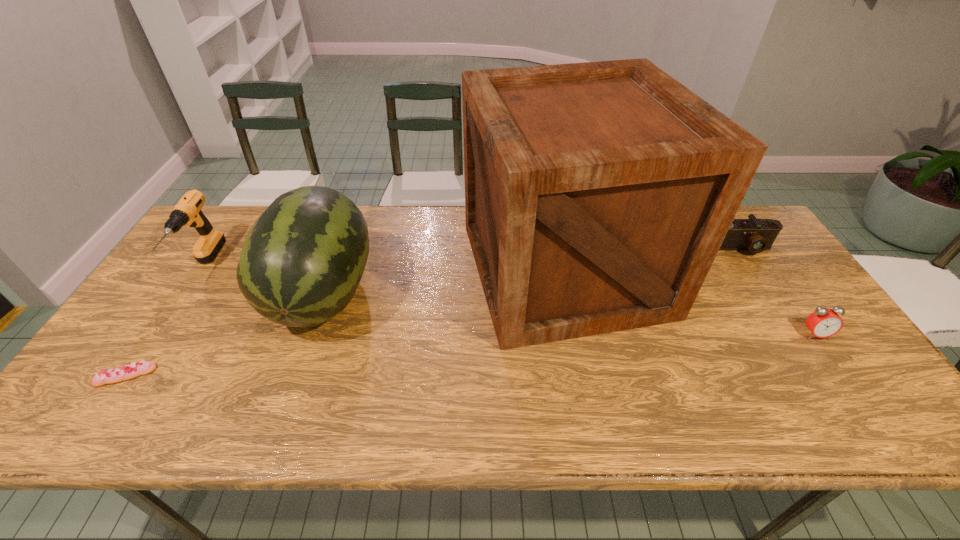
Locate an element on the screen. free space between the nearest object and the drill is located at coordinates (165, 321).

Locate an element on the screen. This screenshot has width=960, height=540. free space between the eclair and the alarm clock is located at coordinates (470, 355).

You are a GUI agent. You are given a task and a screenshot of the screen. Output one action in this format:
    pyautogui.click(x=<x>, y=<y>)
    Task: Click on the blank region between the camera and the eclair
    
    Given the screenshot: What is the action you would take?
    pyautogui.click(x=433, y=312)

The width and height of the screenshot is (960, 540). What are the coordinates of `free space that is in between the eclair and the fourth object from left to right` in the screenshot? It's located at (345, 322).

Identify the location of object that is the third closest one to the tallest object. (823, 322).

Locate an element on the screen. This screenshot has width=960, height=540. the fifth closest object to the alarm clock is located at coordinates (188, 212).

Where is `free location that satisfies the following two spatial constraints: 1. at the tip of the tallest object; 2. on the left side of the drill`? The width and height of the screenshot is (960, 540). free location that satisfies the following two spatial constraints: 1. at the tip of the tallest object; 2. on the left side of the drill is located at coordinates (202, 269).

You are a GUI agent. You are given a task and a screenshot of the screen. Output one action in this format:
    pyautogui.click(x=<x>, y=<y>)
    Task: Click on the vacant area that satisfies the following two spatial constraints: 1. on the back side of the third object from left to right; 2. on the right side of the shortest object
    
    Given the screenshot: What is the action you would take?
    (180, 294)

Locate an element on the screen. The width and height of the screenshot is (960, 540). vacant space that satisfies the following two spatial constraints: 1. on the back side of the tallest object; 2. on the right side of the second tallest object is located at coordinates [x=331, y=269].

Identify the location of vacant space that satisfies the following two spatial constraints: 1. on the back side of the shortest object; 2. on the left side of the third object from right to left. (197, 269).